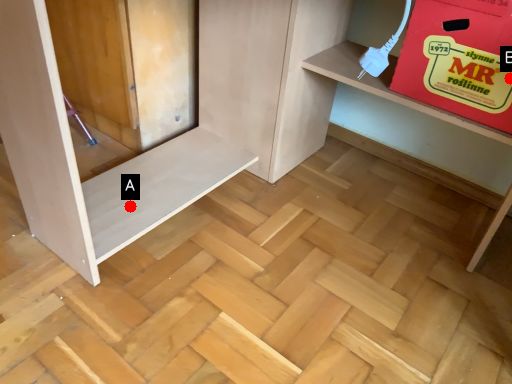
Question: Two points are circled on the image, labeled by A and B beside each circle. Which point is closer to the camera taking this photo?

Choices:
 (A) A is closer
 (B) B is closer

Answer: (B)